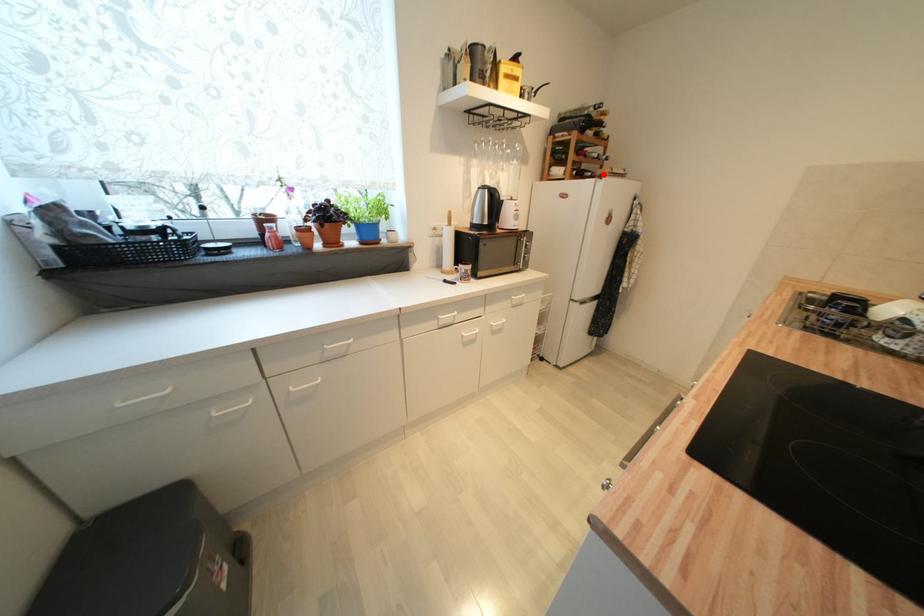
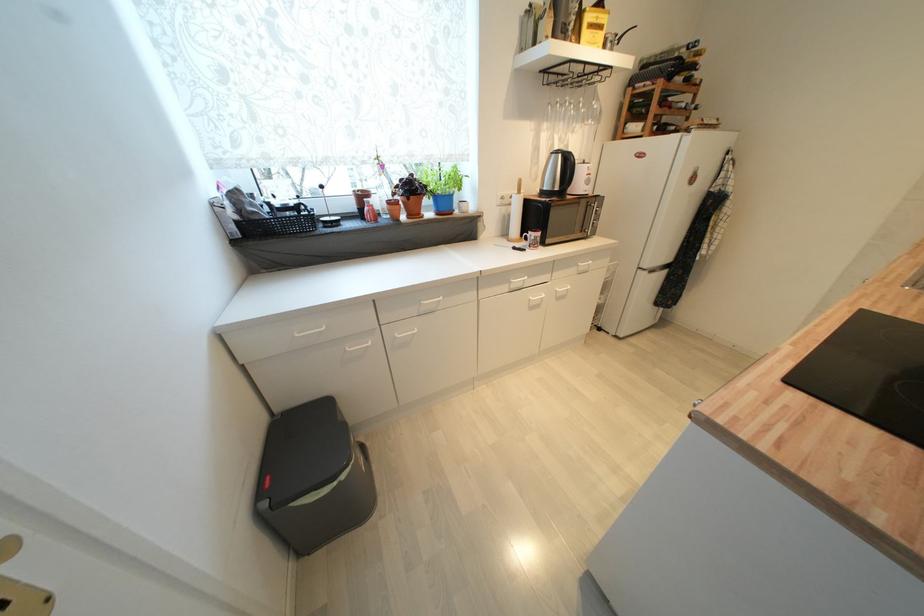
Question: I am providing you with two images of the same scene from different viewpoints. A red point is marked on the first image. At the location where the point appears in image 1, is it still visible in image 2?

Choices:
 (A) Yes
 (B) No

Answer: (A)